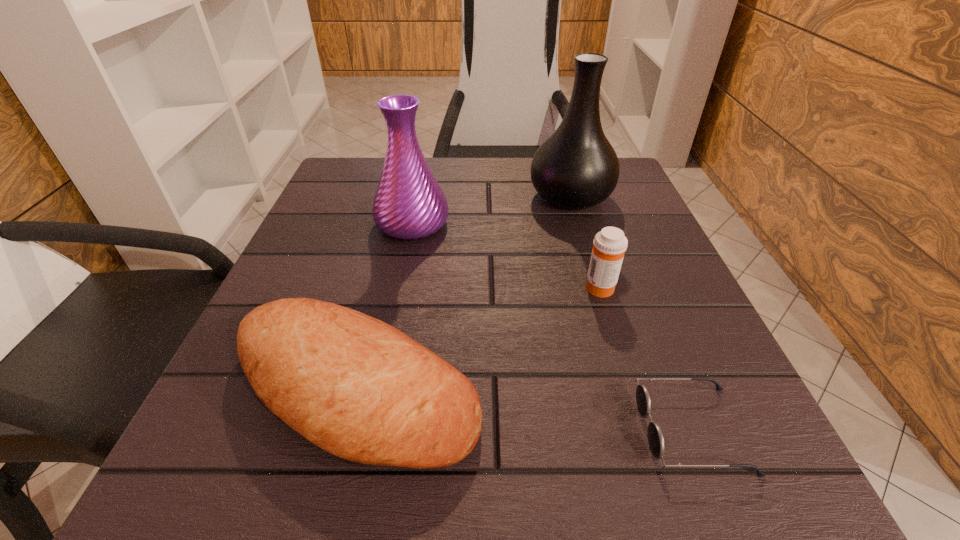
Identify the location of vacant region located on the front-facing side of the shortest object. (545, 430).

Locate an element on the screen. free space located 0.350m on the front-facing side of the shortest object is located at coordinates (358, 430).

I want to click on vacant region located on the front-facing side of the shortest object, so click(342, 430).

Where is `bread that is at the near edge`? bread that is at the near edge is located at coordinates (358, 388).

Locate an element on the screen. This screenshot has height=540, width=960. sunglasses positioned at the near edge is located at coordinates (655, 436).

Find the location of a particular element. vase situated at the left edge is located at coordinates (409, 204).

I want to click on bread at the left edge, so click(x=358, y=388).

The image size is (960, 540). In order to click on vase present at the right edge in this screenshot , I will do `click(576, 167)`.

Where is `medicine that is at the right edge`? medicine that is at the right edge is located at coordinates (610, 244).

Find the location of a particular element. The image size is (960, 540). sunglasses that is at the right edge is located at coordinates (655, 436).